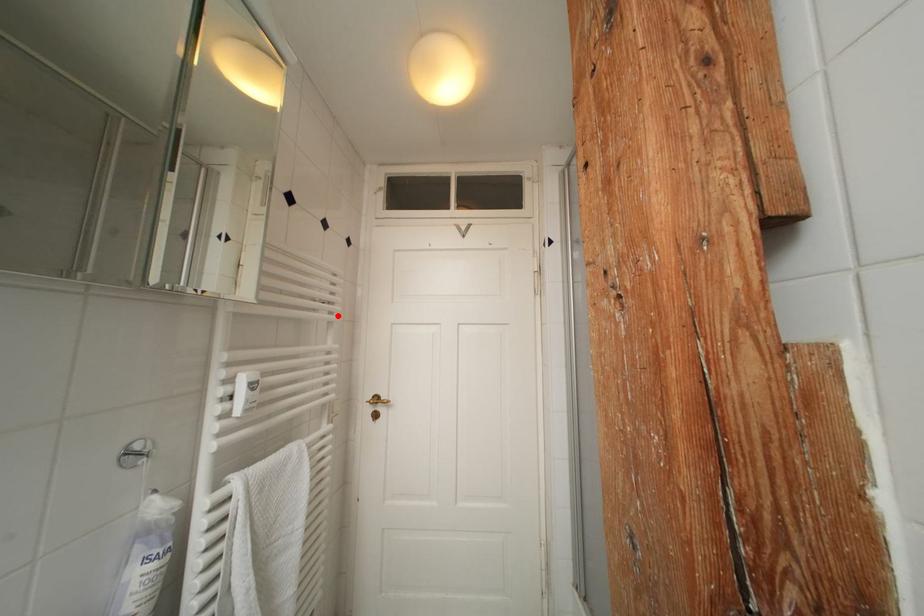
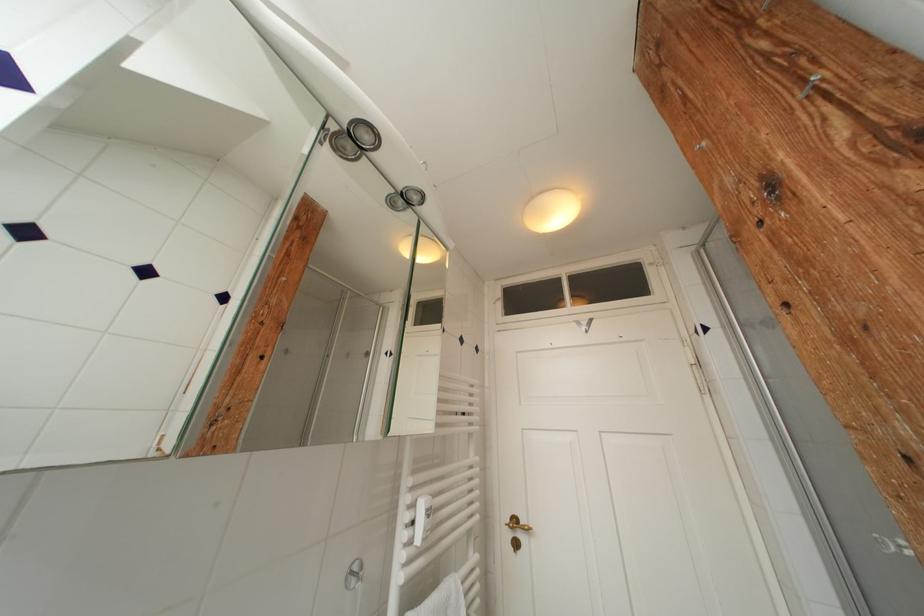
Locate, in the second image, the point that corresponds to the highlighted location in the first image.

(478, 427)